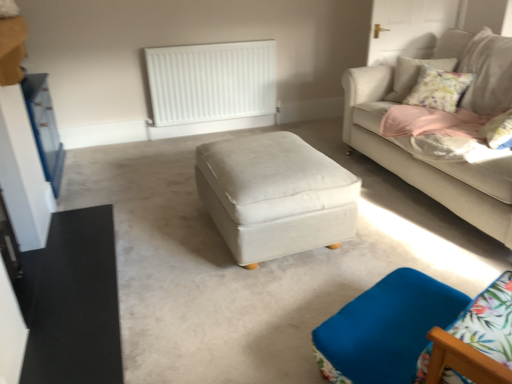
Question: Would you say satin white ottoman at center is inside or outside blue fabric swivel chair at lower right?

Choices:
 (A) outside
 (B) inside

Answer: (A)

Question: In the image, is satin white ottoman at center on the left side or the right side of blue fabric swivel chair at lower right?

Choices:
 (A) left
 (B) right

Answer: (A)

Question: Estimate the real-world distances between objects in this image. Which object is closer to the blue fabric swivel chair at lower right?

Choices:
 (A) white matte radiator at upper center
 (B) light beige fabric couch at upper right
 (C) satin white ottoman at center
 (D) blue glossy dresser at left

Answer: (C)

Question: Estimate the real-world distances between objects in this image. Which object is farther from the white matte radiator at upper center?

Choices:
 (A) blue glossy dresser at left
 (B) blue fabric swivel chair at lower right
 (C) light beige fabric couch at upper right
 (D) satin white ottoman at center

Answer: (B)